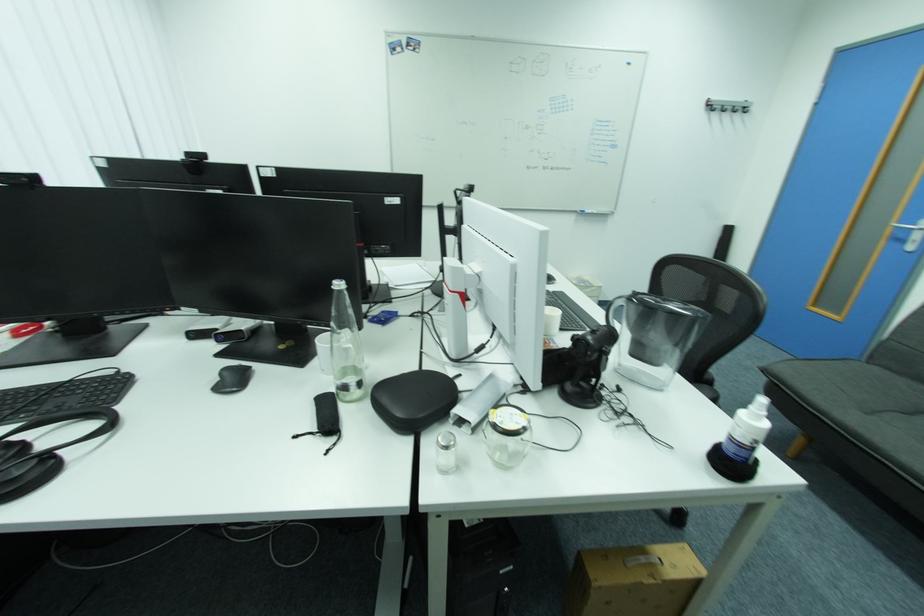
Identify the location of silver door handle. Image resolution: width=924 pixels, height=616 pixels. pos(908,225).